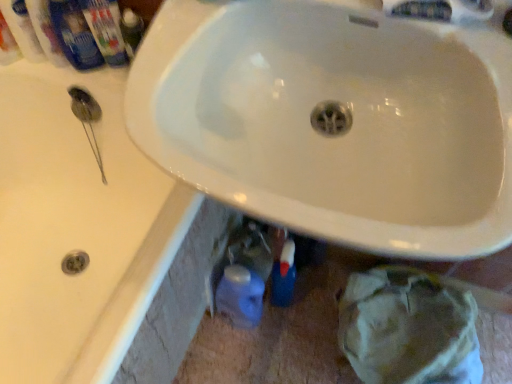
Question: In terms of size, does white glossy mouthwash at upper left, the 3th mouthwash when ordered from right to left, appear bigger or smaller than white glossy sink at upper center?

Choices:
 (A) small
 (B) big

Answer: (A)

Question: From a real-world perspective, is white glossy mouthwash at upper left, which is the second mouthwash in left-to-right order, above or below white glossy sink at upper center?

Choices:
 (A) below
 (B) above

Answer: (B)

Question: Which is farther from the blue plastic mouthwash at upper left, which appears as the 4th mouthwash when viewed from the left?

Choices:
 (A) white plastic mouthwash at upper left, the 1th mouthwash when ordered from left to right
 (B) blue plastic mouthwash at upper left, which ranks as the 2th mouthwash in right-to-left order
 (C) white glossy sink at center
 (D) matte plastic toothpaste tube at upper left
 (E) white glossy sink at upper center

Answer: (C)

Question: Estimate the real-world distances between objects in this image. Which object is closer to the blue plastic mouthwash at upper left, which is counted as the first mouthwash, starting from the right?

Choices:
 (A) blue plastic mouthwash at upper left, which ranks as the 2th mouthwash in right-to-left order
 (B) white glossy sink at center
 (C) white glossy mouthwash at upper left, which is the second mouthwash in left-to-right order
 (D) white plastic mouthwash at upper left, the 1th mouthwash when ordered from left to right
 (E) matte plastic toothpaste tube at upper left

Answer: (A)